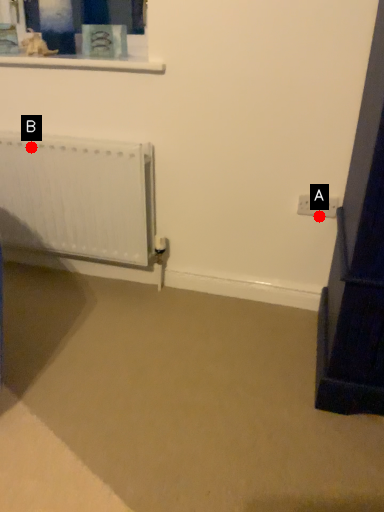
Question: Two points are circled on the image, labeled by A and B beside each circle. Among these points, which one is nearest to the camera?

Choices:
 (A) A is closer
 (B) B is closer

Answer: (A)